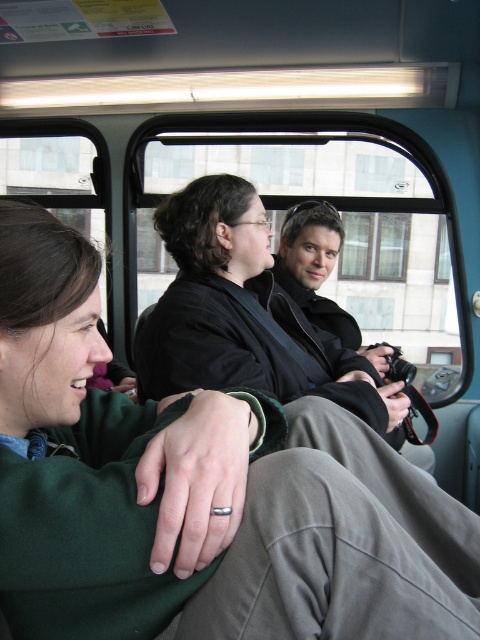
Question: Does green soft sweater at center appear under matte black camera at center?

Choices:
 (A) yes
 (B) no

Answer: (A)

Question: Which point is farther to the camera?

Choices:
 (A) pyautogui.click(x=24, y=368)
 (B) pyautogui.click(x=350, y=348)

Answer: (B)

Question: Considering the relative positions of green soft sweater at center and matte black camera at center in the image provided, where is green soft sweater at center located with respect to matte black camera at center?

Choices:
 (A) left
 (B) right

Answer: (A)

Question: Can you confirm if green soft sweater at center is bigger than matte black camera at center?

Choices:
 (A) yes
 (B) no

Answer: (B)

Question: Among these points, which one is nearest to the camera?

Choices:
 (A) (116, 545)
 (B) (389, 444)

Answer: (A)